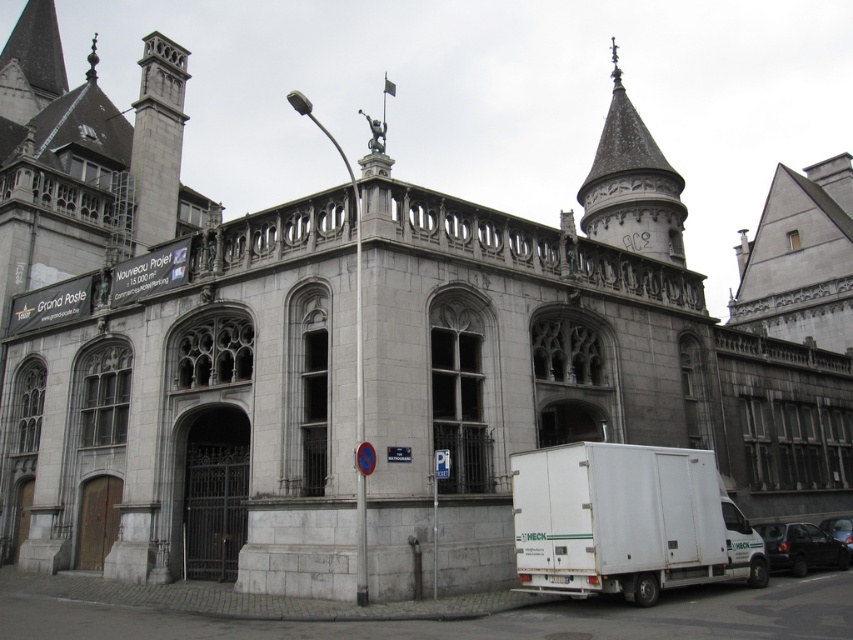
Question: Does black matte van at lower right have a lesser width compared to shiny black car at lower right?

Choices:
 (A) no
 (B) yes

Answer: (B)

Question: Can you confirm if white matte truck at lower right is smaller than gray stone spire at upper right?

Choices:
 (A) yes
 (B) no

Answer: (A)

Question: Which point is farther from the camera taking this photo?

Choices:
 (A) (827, 544)
 (B) (833, 518)

Answer: (B)

Question: Does gray stone spire at upper right appear over black matte van at lower right?

Choices:
 (A) yes
 (B) no

Answer: (A)

Question: Which of the following is the closest to the observer?

Choices:
 (A) (578, 196)
 (B) (779, 550)

Answer: (B)

Question: Which point is farther to the camera?

Choices:
 (A) black matte van at lower right
 (B) gray stone spire at upper right

Answer: (B)